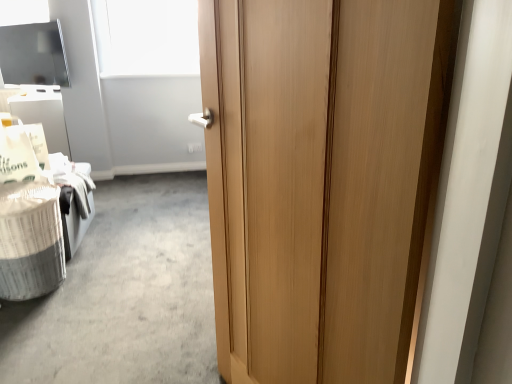
Question: From the image's perspective, is wooden door at center on top of white matte window screen at upper center?

Choices:
 (A) no
 (B) yes

Answer: (A)

Question: Is wooden door at center directly adjacent to white matte window screen at upper center?

Choices:
 (A) no
 (B) yes

Answer: (A)

Question: Can you confirm if wooden door at center is bigger than white matte window screen at upper center?

Choices:
 (A) no
 (B) yes

Answer: (B)

Question: Is wooden door at center thinner than white matte window screen at upper center?

Choices:
 (A) no
 (B) yes

Answer: (B)

Question: Is wooden door at center positioned in front of white matte window screen at upper center?

Choices:
 (A) no
 (B) yes

Answer: (B)

Question: Is white textured laundry basket at lower left inside the boundaries of white matte window screen at upper center, or outside?

Choices:
 (A) outside
 (B) inside

Answer: (A)

Question: From a real-world perspective, is white textured laundry basket at lower left positioned above or below white matte window screen at upper center?

Choices:
 (A) above
 (B) below

Answer: (B)

Question: Considering the positions of white textured laundry basket at lower left and white matte window screen at upper center in the image, is white textured laundry basket at lower left wider or thinner than white matte window screen at upper center?

Choices:
 (A) wide
 (B) thin

Answer: (A)

Question: In the image, is white textured laundry basket at lower left on the left side or the right side of white matte window screen at upper center?

Choices:
 (A) left
 (B) right

Answer: (A)

Question: Based on their positions, is white textured laundry basket at lower left located to the left or right of wooden door at center?

Choices:
 (A) right
 (B) left

Answer: (B)

Question: From their relative heights in the image, would you say white textured laundry basket at lower left is taller or shorter than wooden door at center?

Choices:
 (A) short
 (B) tall

Answer: (A)

Question: Relative to wooden door at center, is white textured laundry basket at lower left in front or behind?

Choices:
 (A) behind
 (B) front

Answer: (A)

Question: Looking at their shapes, would you say white textured laundry basket at lower left is wider or thinner than wooden door at center?

Choices:
 (A) thin
 (B) wide

Answer: (B)

Question: Is white matte window screen at upper center inside the boundaries of wooden door at center, or outside?

Choices:
 (A) inside
 (B) outside

Answer: (B)

Question: Is white matte window screen at upper center taller or shorter than wooden door at center?

Choices:
 (A) tall
 (B) short

Answer: (B)